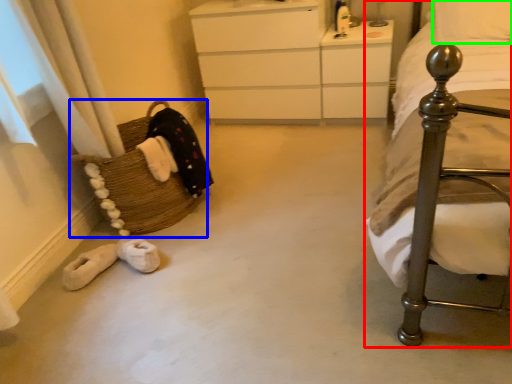
Question: Considering the real-world distances, which object is closest to bed (highlighted by a red box)? basket (highlighted by a blue box) or pillow (highlighted by a green box).

Choices:
 (A) basket
 (B) pillow

Answer: (B)